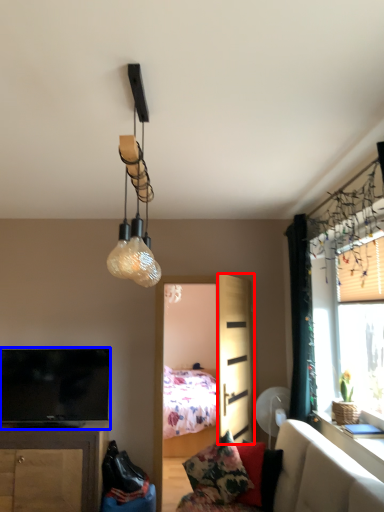
Question: Which object appears closest to the camera in this image, screen door (highlighted by a red box) or television (highlighted by a blue box)?

Choices:
 (A) screen door
 (B) television

Answer: (A)